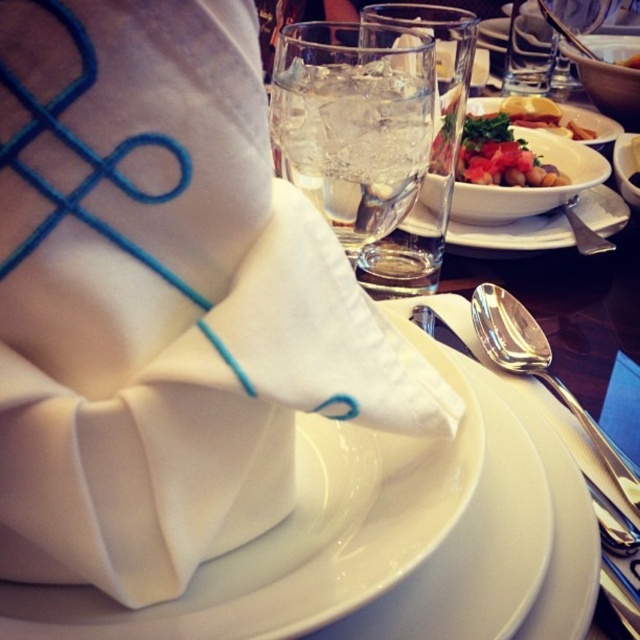
Question: Does white ceramic plate at center have a smaller size compared to tomato salad with croutons at upper right?

Choices:
 (A) yes
 (B) no

Answer: (A)

Question: Which object is closer to the camera taking this photo?

Choices:
 (A) tomato salad with croutons at upper right
 (B) white ceramic bowl at upper center
 (C) white fabric napkin at center

Answer: (C)

Question: Is white fabric napkin at center positioned in front of clear glass water at center?

Choices:
 (A) no
 (B) yes

Answer: (B)

Question: Which object is farther from the camera taking this photo?

Choices:
 (A) satin silver spoon at right
 (B) white fabric napkin at center
 (C) smooth orange carrot at upper right
 (D) tomato salad with croutons at upper right

Answer: (C)

Question: Among these objects, which one is farthest from the camera?

Choices:
 (A) satin silver spoon at right
 (B) clear glass water at center

Answer: (B)

Question: Does clear glass at center appear under white ceramic bowl at upper center?

Choices:
 (A) yes
 (B) no

Answer: (A)